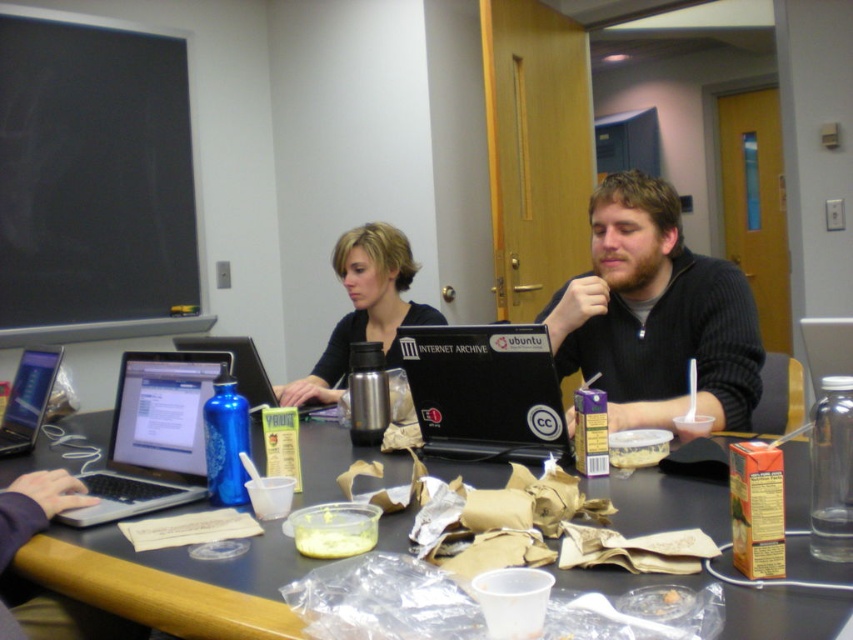
Question: Which object is positioned farthest from the blue glass bottle at center?

Choices:
 (A) black plastic laptop at center
 (B) silver metallic laptop at left

Answer: (A)

Question: Can you confirm if black matte laptop at center is positioned below silver metallic laptop at left?

Choices:
 (A) yes
 (B) no

Answer: (B)

Question: Does black matte laptop at center appear on the right side of black plastic laptop at center?

Choices:
 (A) yes
 (B) no

Answer: (A)

Question: Which object is closer to the camera taking this photo?

Choices:
 (A) black plastic table at center
 (B) silver metallic laptop at left
 (C) metallic silver laptop at left
 (D) brushed metal thermos at center

Answer: (A)

Question: Which object appears closest to the camera in this image?

Choices:
 (A) black matte laptop at center
 (B) black plastic laptop at center
 (C) black plastic table at center

Answer: (C)

Question: From the image, what is the correct spatial relationship of dark gray sweater at center in relation to black matte shirt at center?

Choices:
 (A) below
 (B) above

Answer: (B)